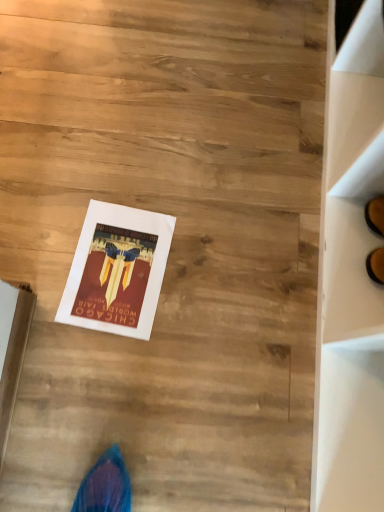
You are a GUI agent. You are given a task and a screenshot of the screen. Output one action in this format:
    pyautogui.click(x=<x>, y=<y>)
    Task: Click on the free space in front of matte paper poster at center
    
    Given the screenshot: What is the action you would take?
    pyautogui.click(x=98, y=377)